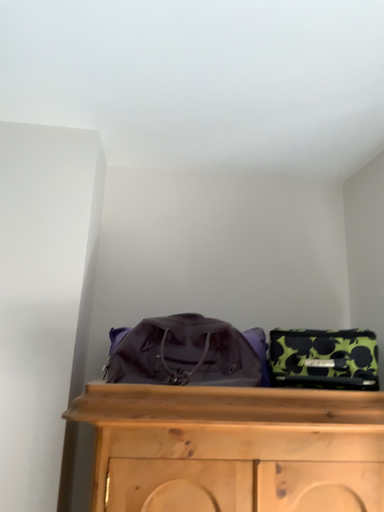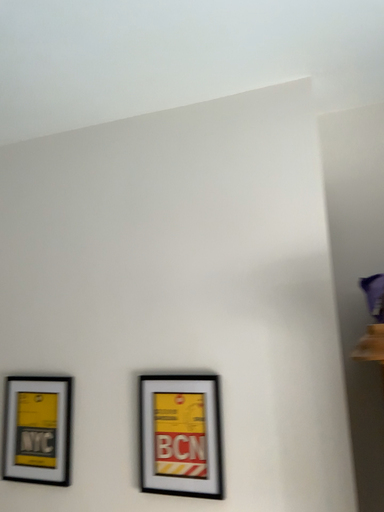
Question: How did the camera likely rotate when shooting the video?

Choices:
 (A) rotated right
 (B) rotated left

Answer: (B)